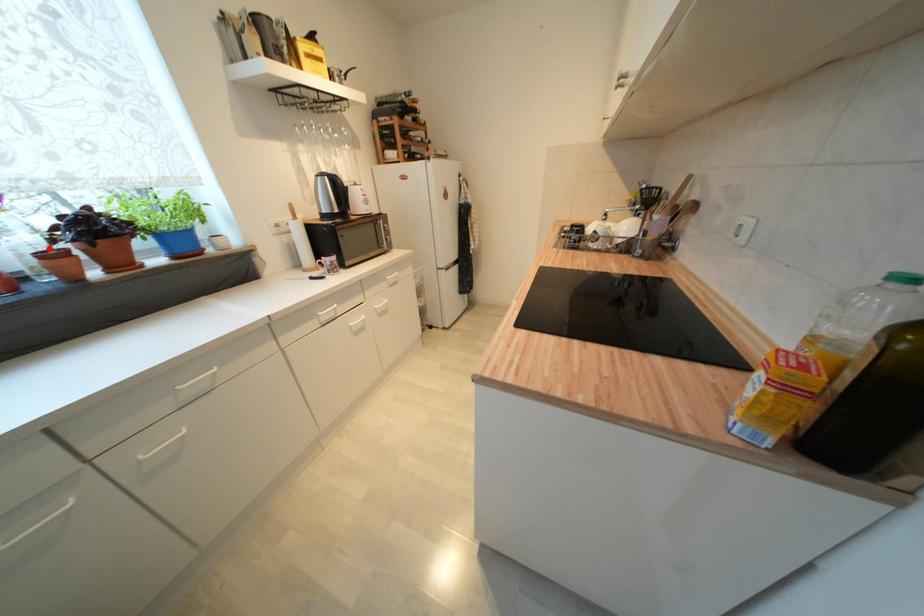
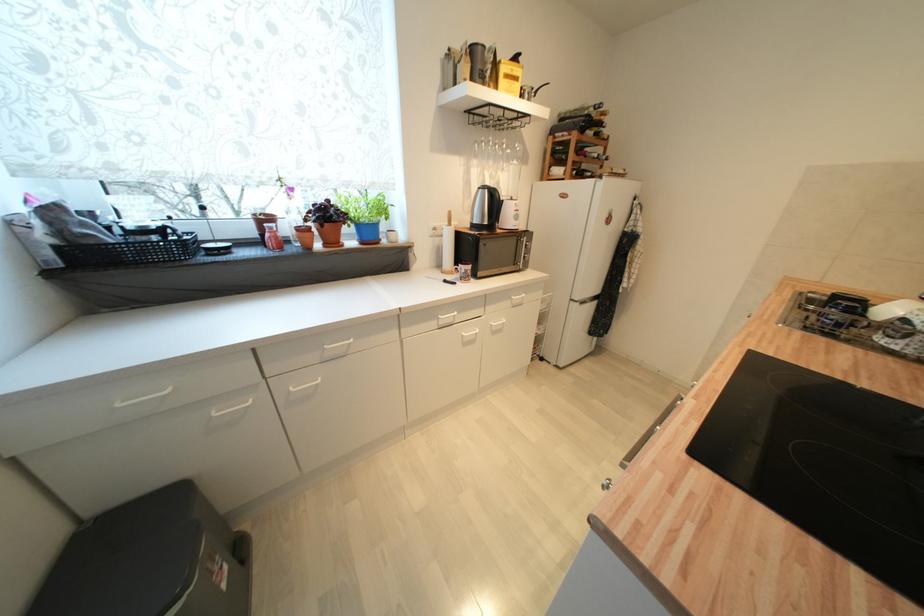
Find the pixel in the second image that matches the highlighted location in the first image.

(306, 225)